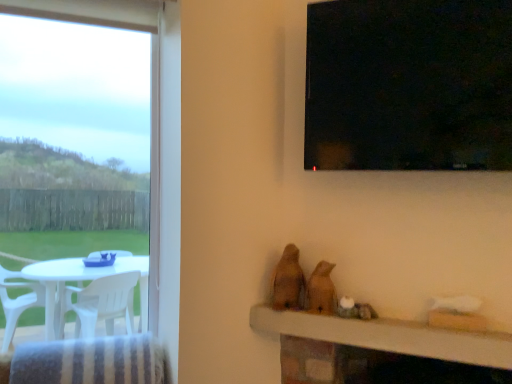
Identify the location of brown matte bird at center, the 1th animal viewed from the left. This screenshot has width=512, height=384. (288, 281).

At what (x,y) coordinates should I click in order to perform the action: click on brown matte bird at center, the first animal from the right. Please return your answer as a coordinate pair (x, y). The width and height of the screenshot is (512, 384). Looking at the image, I should click on (321, 289).

What do you see at coordinates (389, 336) in the screenshot? I see `wooden table at lower center` at bounding box center [389, 336].

Image resolution: width=512 pixels, height=384 pixels. What are the coordinates of `brown matte bird at center, the 1th animal viewed from the left` in the screenshot? It's located at (288, 281).

How different are the orientations of wooden table at lower center and transparent glass window at upper right in degrees?

wooden table at lower center and transparent glass window at upper right are facing 0.461 degrees away from each other.

Is wooden table at lower center facing towards transparent glass window at upper right?

No, wooden table at lower center is not oriented towards transparent glass window at upper right.

Consider the image. Looking at the image, does wooden table at lower center seem bigger or smaller compared to transparent glass window at upper right?

Clearly, wooden table at lower center is smaller in size than transparent glass window at upper right.

Which object is further away from the camera, wooden table at lower center or transparent glass window at upper right?

wooden table at lower center is behind.

Are wooden table at lower center and brown matte bird at center, the 1th animal viewed from the left, far apart?

No, wooden table at lower center is not far from brown matte bird at center, the 1th animal viewed from the left.

Is wooden table at lower center facing away from brown matte bird at center, which ranks as the second animal in right-to-left order?

No.

Is wooden table at lower center at the left side of brown matte bird at center, the 1th animal viewed from the left?

Incorrect, wooden table at lower center is not on the left side of brown matte bird at center, the 1th animal viewed from the left.

Locate an element on the screen. The width and height of the screenshot is (512, 384). table below the brown matte bird at center, which ranks as the second animal in right-to-left order (from a real-world perspective) is located at coordinates (389, 336).

What's the angular difference between brown matte bird at center, which ranks as the second animal in right-to-left order, and transparent glass window at upper right's facing directions?

1.04 degrees separate the facing orientations of brown matte bird at center, which ranks as the second animal in right-to-left order, and transparent glass window at upper right.

From the picture: Is brown matte bird at center, the 1th animal viewed from the left, far from transparent glass window at upper right?

brown matte bird at center, the 1th animal viewed from the left, is actually quite close to transparent glass window at upper right.

Is brown matte bird at center, the 1th animal viewed from the left, completely or partially outside of transparent glass window at upper right?

That's correct, brown matte bird at center, the 1th animal viewed from the left, is outside of transparent glass window at upper right.

From a real-world perspective, between brown matte bird at center, the first animal from the right, and brown matte bird at center, which ranks as the second animal in right-to-left order, who is vertically lower?

From a 3D spatial view, brown matte bird at center, the first animal from the right, is below.

Between brown matte bird at center, the 2th animal when ordered from left to right, and brown matte bird at center, the 1th animal viewed from the left, which one has larger width?

brown matte bird at center, the 1th animal viewed from the left.

Considering their positions, is brown matte bird at center, the 2th animal when ordered from left to right, located in front of or behind brown matte bird at center, which ranks as the second animal in right-to-left order?

In the image, brown matte bird at center, the 2th animal when ordered from left to right, appears in front of brown matte bird at center, which ranks as the second animal in right-to-left order.

Based on the photo, measure the distance from brown matte bird at center, the 2th animal when ordered from left to right, to brown matte bird at center, which ranks as the second animal in right-to-left order.

A distance of 6.94 centimeters exists between brown matte bird at center, the 2th animal when ordered from left to right, and brown matte bird at center, which ranks as the second animal in right-to-left order.

Considering the positions of points (348, 30) and (284, 267), is point (348, 30) closer to camera compared to point (284, 267)?

Yes, point (348, 30) is closer to viewer.

Are transparent glass window at upper right and brown matte bird at center, which ranks as the second animal in right-to-left order, located far from each other?

That's not correct — transparent glass window at upper right is a little close to brown matte bird at center, which ranks as the second animal in right-to-left order.

Is brown matte bird at center, the 1th animal viewed from the left, located within transparent glass window at upper right?

No, brown matte bird at center, the 1th animal viewed from the left, is not surrounded by transparent glass window at upper right.

From a real-world perspective, is transparent glass window at upper right beneath brown matte bird at center, which ranks as the second animal in right-to-left order?

No, from a real-world perspective, transparent glass window at upper right is not below brown matte bird at center, which ranks as the second animal in right-to-left order.

From a real-world perspective, which object rests below the other?

wooden table at lower center is physically lower.

What's the angular difference between transparent glass window at upper right and wooden table at lower center's facing directions?

The angular difference between transparent glass window at upper right and wooden table at lower center is 0.461 degrees.

Considering the relative sizes of transparent glass window at upper right and wooden table at lower center in the image provided, is transparent glass window at upper right smaller than wooden table at lower center?

No, transparent glass window at upper right is not smaller than wooden table at lower center.

Is wooden table at lower center at the back of transparent glass window at upper right?

transparent glass window at upper right is not turned away from wooden table at lower center.

Does point (316, 274) come closer to viewer compared to point (314, 49)?

No, (316, 274) is behind (314, 49).

Is transparent glass window at upper right at the back of brown matte bird at center, the 2th animal when ordered from left to right?

No, brown matte bird at center, the 2th animal when ordered from left to right,'s orientation is not away from transparent glass window at upper right.

From the image's perspective, is brown matte bird at center, the 2th animal when ordered from left to right, over transparent glass window at upper right?

No.

I want to click on window that is on the right side of wooden table at lower center, so click(x=409, y=85).

The image size is (512, 384). Find the location of `the 2nd animal behind the wooden table at lower center, starting your count from the anchor`. the 2nd animal behind the wooden table at lower center, starting your count from the anchor is located at coordinates (288, 281).

Based on their spatial positions, is brown matte bird at center, the 2th animal when ordered from left to right, or brown matte bird at center, the 1th animal viewed from the left, closer to wooden table at lower center?

brown matte bird at center, the 2th animal when ordered from left to right, is closer to wooden table at lower center.

Estimate the real-world distances between objects in this image. Which object is closer to transparent glass window at upper right, wooden table at lower center or brown matte bird at center, the 2th animal when ordered from left to right?

brown matte bird at center, the 2th animal when ordered from left to right, is closer to transparent glass window at upper right.

From the image, which object appears to be nearer to brown matte bird at center, the first animal from the right, wooden table at lower center or brown matte bird at center, which ranks as the second animal in right-to-left order?

Among the two, brown matte bird at center, which ranks as the second animal in right-to-left order, is located nearer to brown matte bird at center, the first animal from the right.

Estimate the real-world distances between objects in this image. Which object is closer to wooden table at lower center, transparent glass window at upper right or brown matte bird at center, the 1th animal viewed from the left?

brown matte bird at center, the 1th animal viewed from the left.

Based on their spatial positions, is brown matte bird at center, which ranks as the second animal in right-to-left order, or wooden table at lower center further from transparent glass window at upper right?

wooden table at lower center lies further to transparent glass window at upper right than the other object.

Estimate the real-world distances between objects in this image. Which object is closer to wooden table at lower center, transparent glass window at upper right or brown matte bird at center, the first animal from the right?

The object closer to wooden table at lower center is brown matte bird at center, the first animal from the right.

When comparing their distances from wooden table at lower center, does brown matte bird at center, the first animal from the right, or transparent glass window at upper right seem closer?

brown matte bird at center, the first animal from the right, is positioned closer to the anchor wooden table at lower center.

From the image, which object appears to be farther from transparent glass window at upper right, brown matte bird at center, the 1th animal viewed from the left, or brown matte bird at center, the first animal from the right?

brown matte bird at center, the first animal from the right, lies further to transparent glass window at upper right than the other object.

At what (x,y) coordinates should I click in order to perform the action: click on animal between brown matte bird at center, the 1th animal viewed from the left, and wooden table at lower center, in the horizontal direction. Please return your answer as a coordinate pair (x, y). Looking at the image, I should click on (321, 289).

This screenshot has width=512, height=384. Find the location of `animal between transparent glass window at upper right and brown matte bird at center, the 2th animal when ordered from left to right, vertically`. animal between transparent glass window at upper right and brown matte bird at center, the 2th animal when ordered from left to right, vertically is located at coordinates (288, 281).